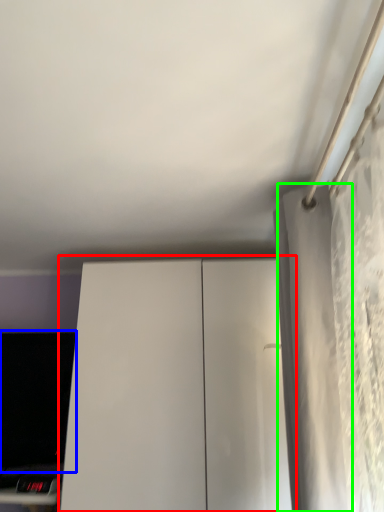
Question: Which object is positioned farthest from dresser (highlighted by a red box)? Select from computer monitor (highlighted by a blue box) and curtain (highlighted by a green box).

Choices:
 (A) computer monitor
 (B) curtain

Answer: (B)